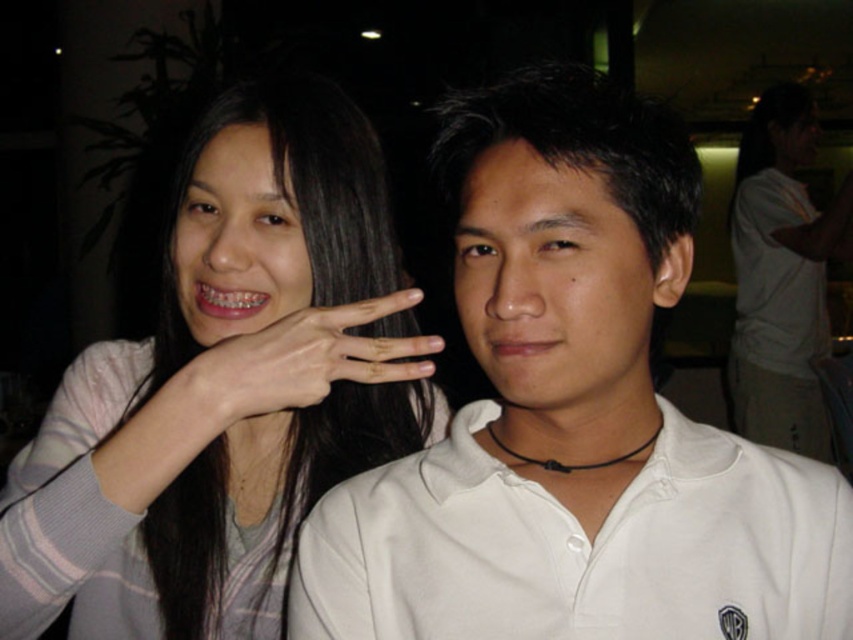
You are a photographer at a social event and need to ensure that two people in the photo are at least 70 centimeters apart for proper framing. The two people in the image are standing at point (201, 241). Can you confirm if they meet the required distance?

The two people at point (201, 241) are 72.52 centimeters apart, which exceeds the minimum requirement of 70 centimeters. Therefore, they meet the required distance for proper framing.

You are organizing a clothing display and need to arrange the white cotton shirt at center and the white matte shirt at upper right based on their lengths. Which shirt should be placed on the lower shelf if the lower shelf is for shorter items?

The white cotton shirt at center is shorter than the white matte shirt at upper right, so it should be placed on the lower shelf designated for shorter items.